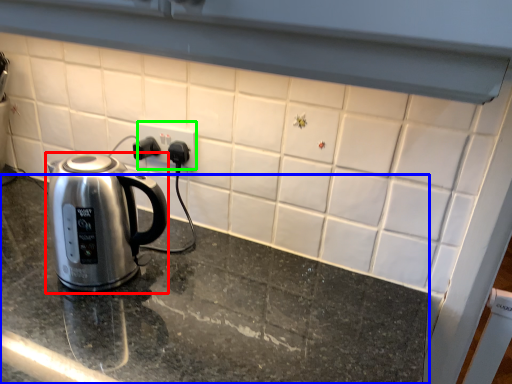
Question: Which object is the closest to the kettle (highlighted by a red box)? Choose among these: table top (highlighted by a blue box) or electric outlet (highlighted by a green box).

Choices:
 (A) table top
 (B) electric outlet

Answer: (A)